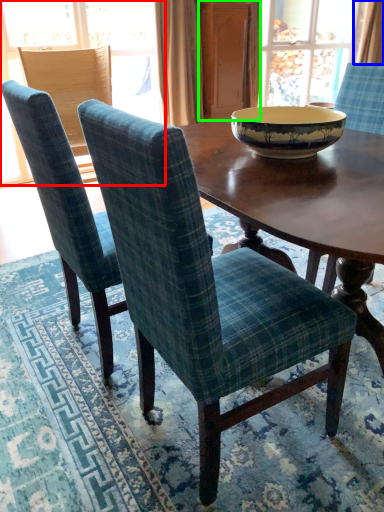
Question: Based on their relative distances, which object is nearer to window (highlighted by a red box)? Choose from curtain (highlighted by a blue box) and screen door (highlighted by a green box).

Choices:
 (A) curtain
 (B) screen door

Answer: (B)